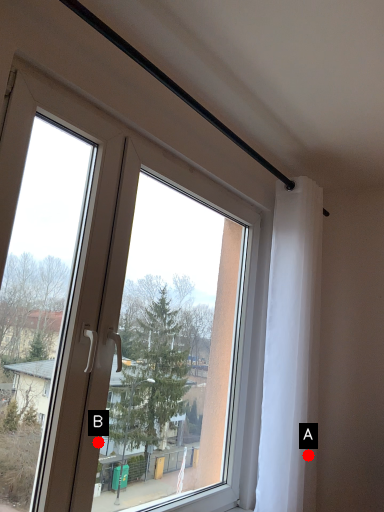
Question: Two points are circled on the image, labeled by A and B beside each circle. Which point is closer to the camera?

Choices:
 (A) A is closer
 (B) B is closer

Answer: (B)